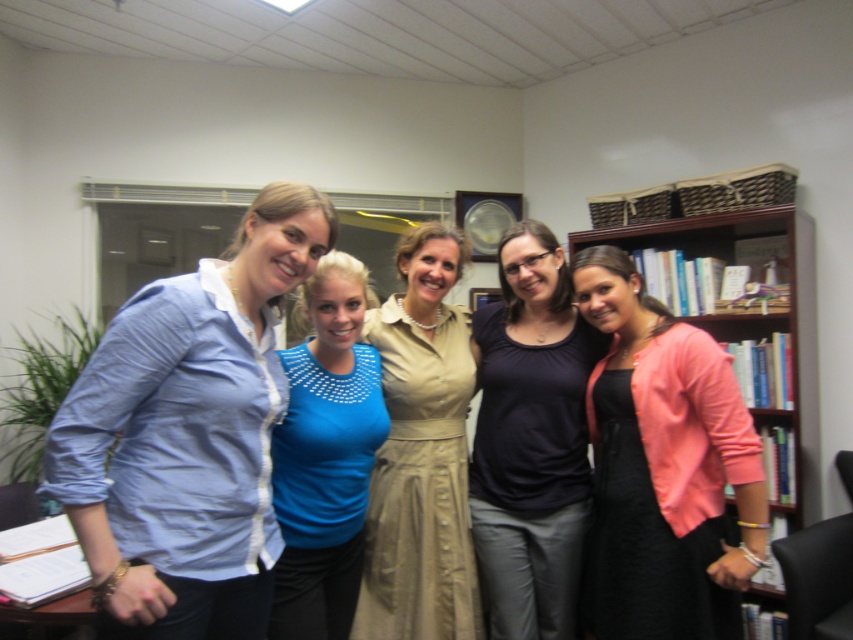
You are a photographer setting up for a group photo. You need to position the light blue shirt at left and the matte beige dress at center so that both are visible in the frame. Considering their heights, which object should be placed closer to the front to ensure both are fully visible?

The light blue shirt at left is shorter than the matte beige dress at center, so placing the light blue shirt at left closer to the front will ensure both are fully visible in the frame.

You are standing in the office scene described. There are two points marked in the image, namely point (77, 390) and point (450, 401). Which of these two points is nearer to your current position?

Point (77, 390) is closer to the viewer than point (450, 401), so the point (77, 390) is nearer to your current position.

You are an interior designer tasked with placing a new decorative item on the floor between the matte beige dress at center and the blue jersey at center. Based on their positions, which object should the decorative item be placed closer to?

The decorative item should be placed closer to the blue jersey at center because the matte beige dress at center is located above the blue jersey at center, meaning the blue jersey is lower and thus closer to the floor.